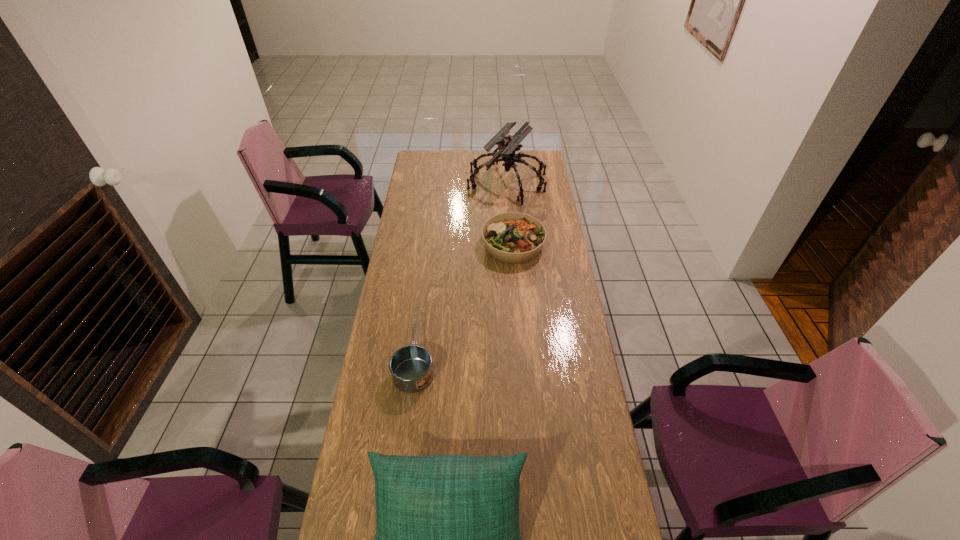
Identify the location of drone that is positioned at the right edge. (507, 146).

The image size is (960, 540). Identify the location of salad plate that is positioned at the right edge. (511, 237).

You are a GUI agent. You are given a task and a screenshot of the screen. Output one action in this format:
    pyautogui.click(x=<x>, y=<y>)
    Task: Click on the object positioned at the far right corner
    The image size is (960, 540).
    Given the screenshot: What is the action you would take?
    pyautogui.click(x=507, y=146)

Image resolution: width=960 pixels, height=540 pixels. In order to click on vacant area at the far edge of the desktop in this screenshot , I will do `click(486, 154)`.

Locate an element on the screen. The image size is (960, 540). vacant area at the left edge of the desktop is located at coordinates (402, 227).

The height and width of the screenshot is (540, 960). In the image, there is a desktop. What are the coordinates of `vacant space at the far right corner` in the screenshot? It's located at (548, 169).

At what (x,y) coordinates should I click in order to perform the action: click on free space between the drone and the second nearest object. Please return your answer as a coordinate pair (x, y). This screenshot has width=960, height=540. Looking at the image, I should click on pyautogui.click(x=462, y=267).

Find the location of `free space between the third nearest object and the saucepan`. free space between the third nearest object and the saucepan is located at coordinates (465, 299).

This screenshot has height=540, width=960. I want to click on vacant area between the salad plate and the second nearest object, so click(465, 299).

Point out which object is positioned as the third nearest to the third nearest object. Please provide its 2D coordinates. Your answer should be formatted as a tuple, i.e. [(x, y)], where the tuple contains the x and y coordinates of a point satisfying the conditions above.

[(447, 539)]